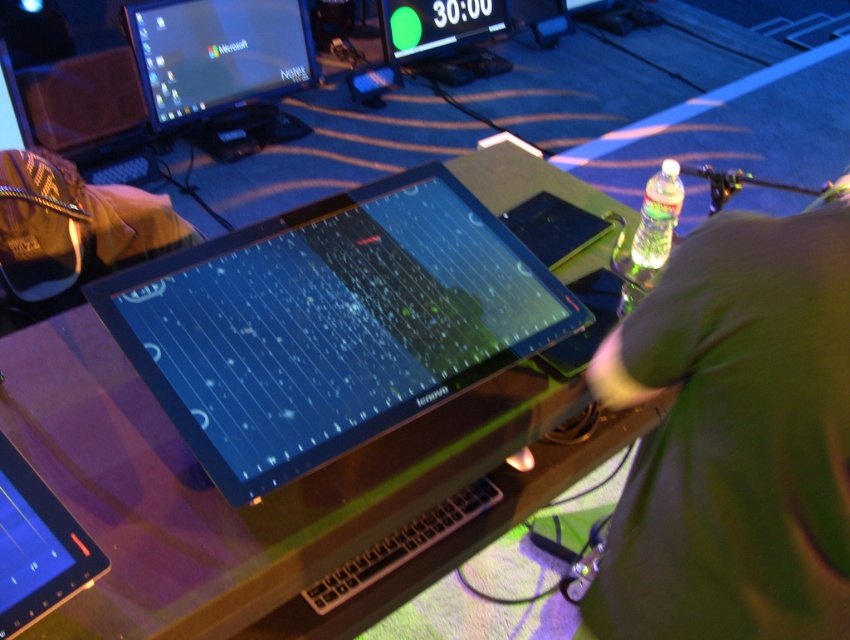
Which is in front, point (216, 58) or point (416, 32)?

Point (216, 58) is more forward.

The image size is (850, 640). Identify the location of matte black monitor at upper left. (218, 54).

Does green fabric shirt at lower right appear on the left side of black glossy tablet at lower left?

In fact, green fabric shirt at lower right is to the right of black glossy tablet at lower left.

Is point (717, 330) behind point (14, 470)?

No, it is in front of (14, 470).

This screenshot has width=850, height=640. What are the coordinates of `green fabric shirt at lower right` in the screenshot? It's located at (734, 436).

Measure the distance from green fabric shirt at lower right to matte black monitor at upper center.

They are 3.09 meters apart.

Is point (774, 483) positioned behind point (443, 16)?

That is False.

In order to click on green fabric shirt at lower right in this screenshot , I will do `click(734, 436)`.